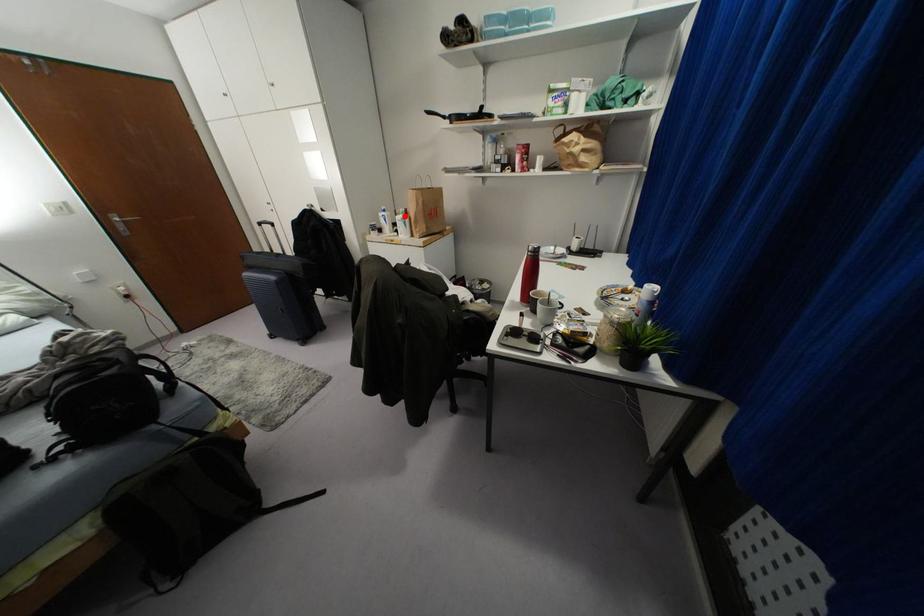
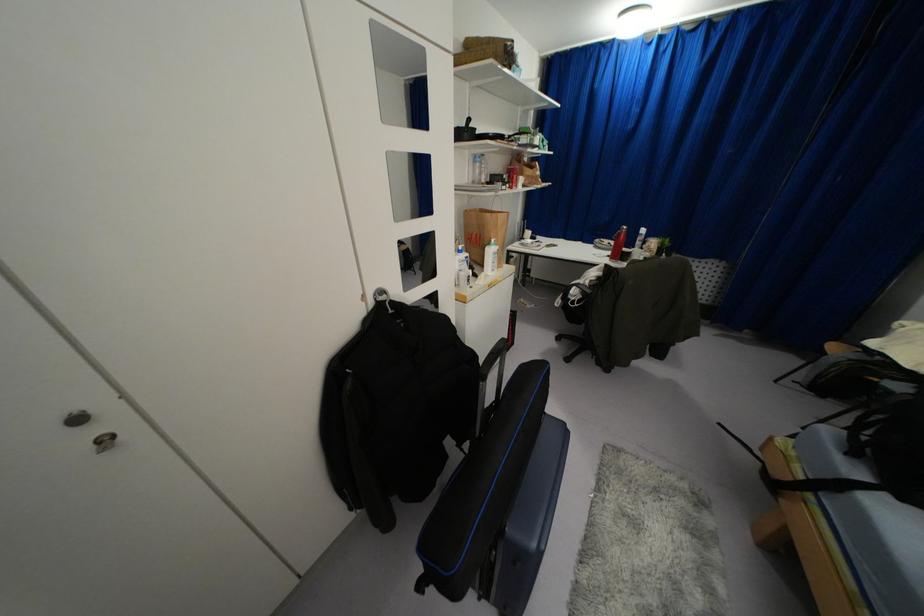
The point at the highlighted location is marked in the first image. Where is the corresponding point in the second image?

(495, 246)